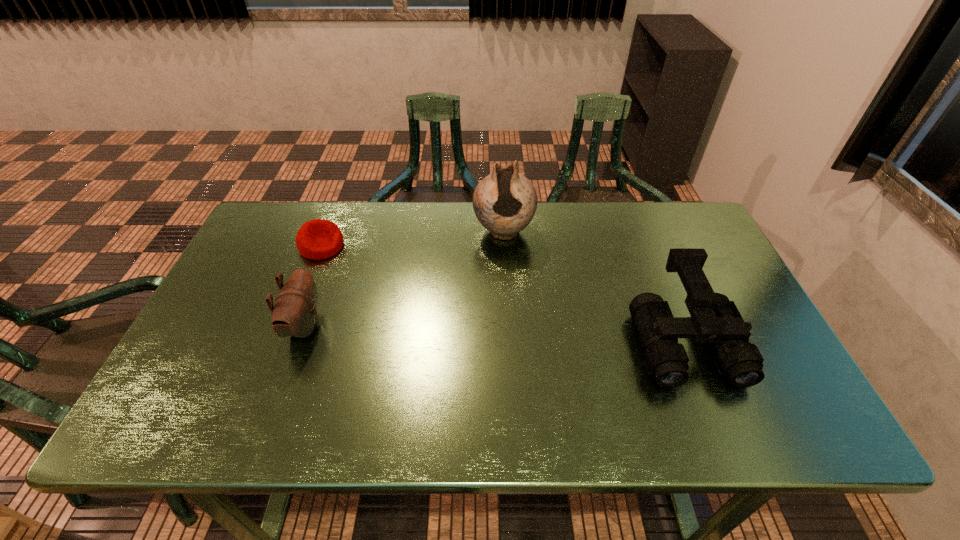
Find the location of a particular element. The image size is (960, 540). vacant region at the far edge is located at coordinates (388, 229).

The image size is (960, 540). Identify the location of free space at the near edge of the desktop. (554, 391).

The width and height of the screenshot is (960, 540). In the image, there is a desktop. What are the coordinates of `free space at the left edge` in the screenshot? It's located at (244, 278).

Image resolution: width=960 pixels, height=540 pixels. I want to click on vacant space at the far left corner of the desktop, so click(295, 213).

This screenshot has width=960, height=540. In order to click on vacant space at the far right corner of the desktop in this screenshot , I will do `click(668, 205)`.

Locate an element on the screen. empty space between the second object from right to left and the second shortest object is located at coordinates (404, 279).

This screenshot has width=960, height=540. I want to click on empty space that is in between the rightmost object and the tallest object, so click(x=593, y=286).

This screenshot has height=540, width=960. I want to click on free space that is in between the pouch and the pottery, so click(x=404, y=279).

Find the location of a particular element. free space between the shortest object and the third object from left to right is located at coordinates [413, 239].

This screenshot has height=540, width=960. Find the location of `free space between the pottery and the third shortest object`. free space between the pottery and the third shortest object is located at coordinates (593, 286).